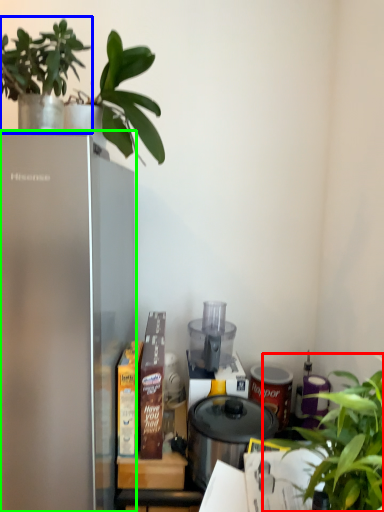
Question: Which object is positioned farthest from houseplant (highlighted by a red box)? Select from houseplant (highlighted by a blue box) and refrigerator (highlighted by a green box).

Choices:
 (A) houseplant
 (B) refrigerator

Answer: (A)